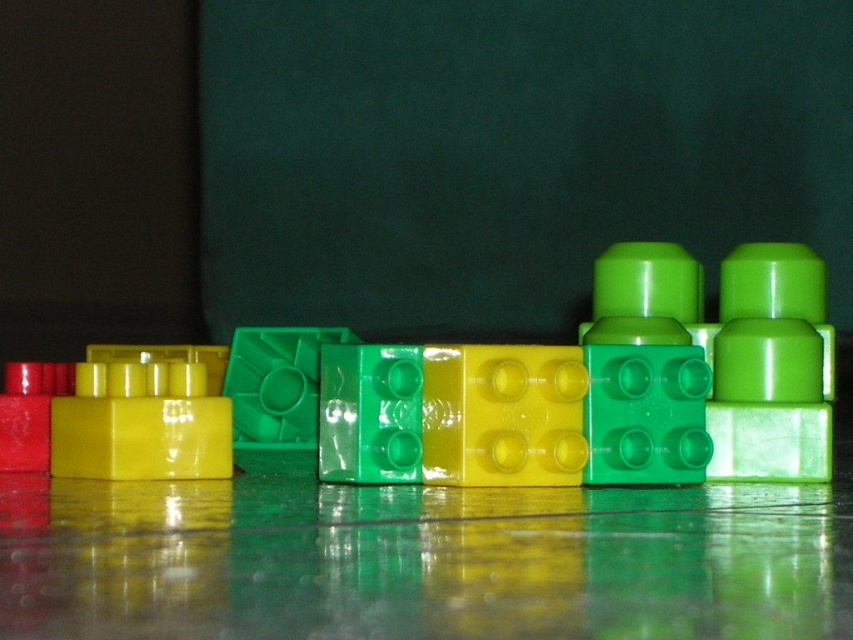
Consider the image. You are a child trying to build a tower using the green plastic blocks at center and the matte red block at left. Which block should you choose if you want to use the larger one for the base?

You should choose the green plastic blocks at center because it is bigger than the matte red block at left, making it a more stable base for the tower.